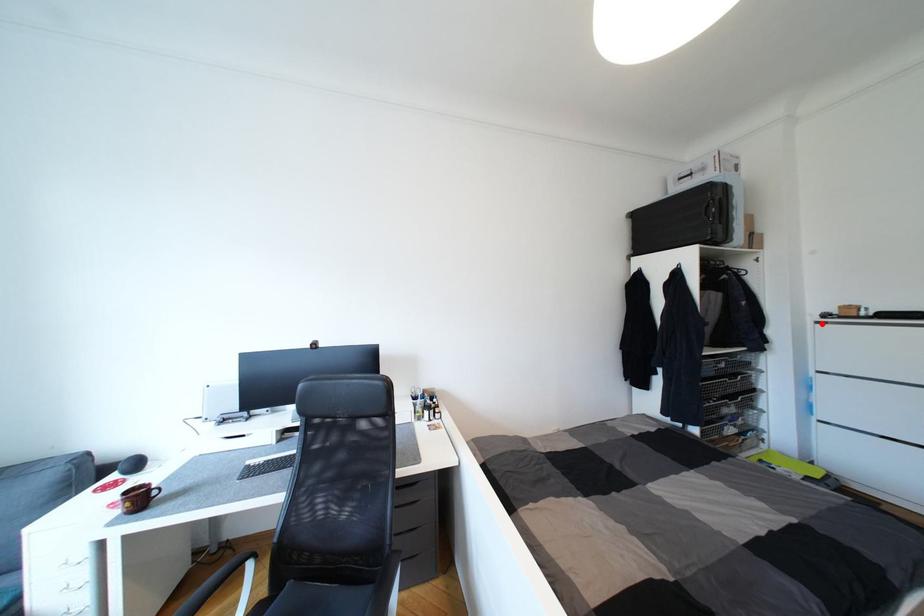
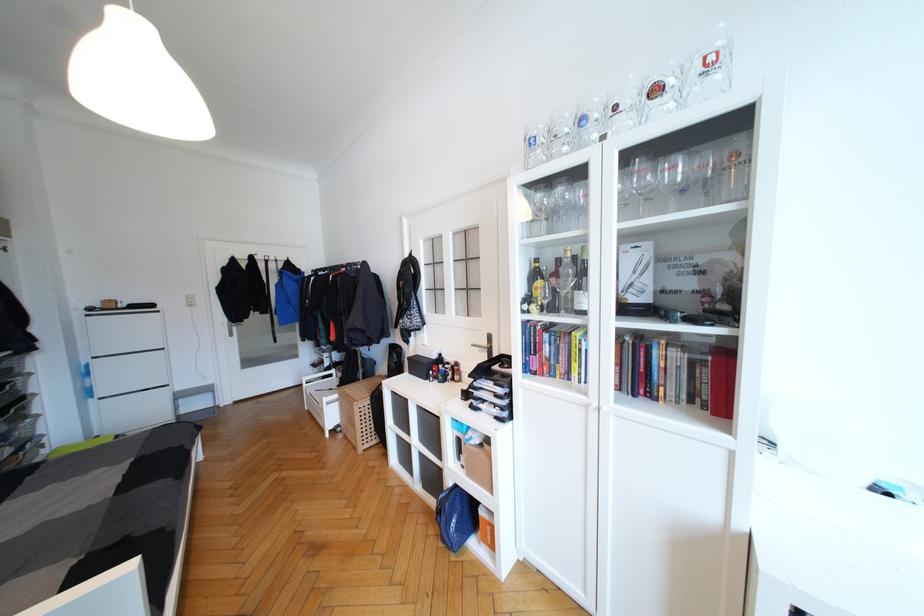
The point at the highlighted location is marked in the first image. Where is the corresponding point in the second image?

(91, 317)